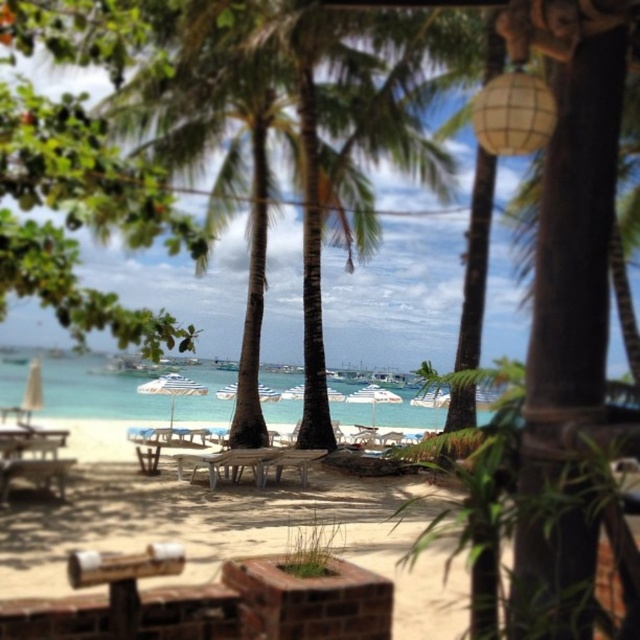
Question: Can you confirm if brick textured bench at center is bigger than wooden table at center?

Choices:
 (A) no
 (B) yes

Answer: (B)

Question: Which point is closer to the camera?

Choices:
 (A) white wood picnic table at center
 (B) wooden table at center
 (C) brick textured bench at center

Answer: (C)

Question: Is brick textured bench at center bigger than wooden picnic table at lower left?

Choices:
 (A) no
 (B) yes

Answer: (B)

Question: Which point is farther to the camera?

Choices:
 (A) (49, 515)
 (B) (38, 481)
 (C) (324, 454)
 (D) (92, 406)

Answer: (D)

Question: Does clear blue water at center appear on the right side of wooden picnic table at lower left?

Choices:
 (A) yes
 (B) no

Answer: (A)

Question: Which object is positioned farthest from the brick textured bench at center?

Choices:
 (A) wooden picnic table at lower left
 (B) white wood picnic table at center

Answer: (A)